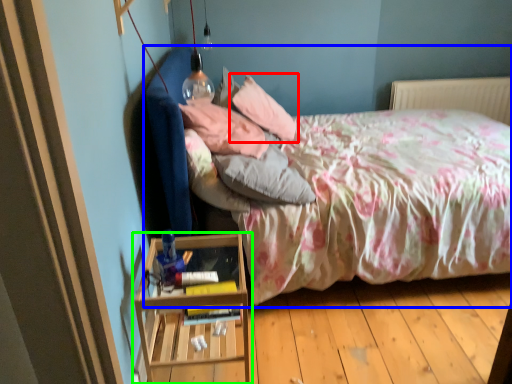
Question: Which object is the farthest from pillow (highlighted by a red box)? Choose among these: bed (highlighted by a blue box) or nightstand (highlighted by a green box).

Choices:
 (A) bed
 (B) nightstand

Answer: (B)